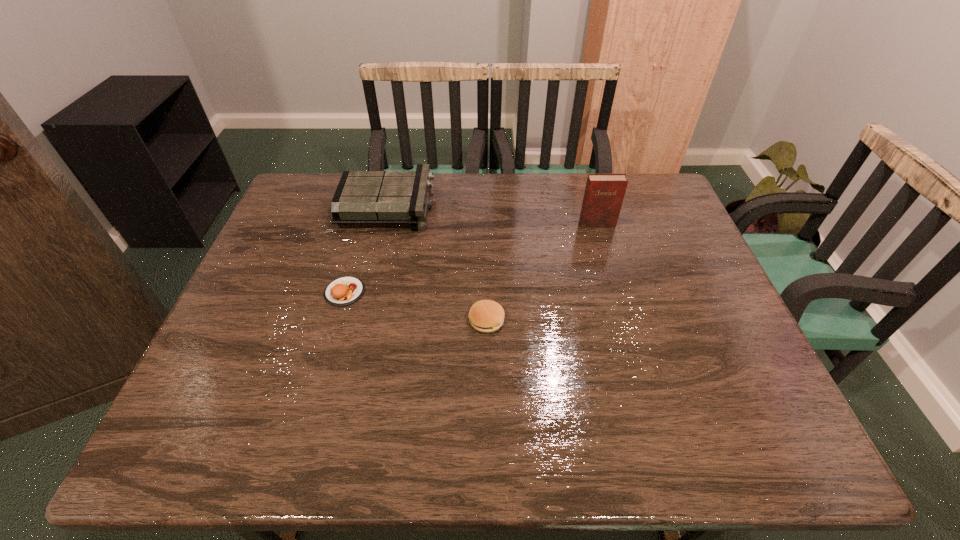
Choose which object is the nearest neighbor to the second object from right to left. Please provide its 2D coordinates. Your answer should be formatted as a tuple, i.e. [(x, y)], where the tuple contains the x and y coordinates of a point satisfying the conditions above.

[(343, 291)]

Locate an element on the screen. This screenshot has width=960, height=540. the third closest object relative to the second tallest object is located at coordinates (604, 193).

What are the coordinates of `vacant region that satisfies the following two spatial constraints: 1. on the front side of the right patty (food); 2. on the left side of the left patty (food)` in the screenshot? It's located at [336, 321].

I want to click on vacant space that satisfies the following two spatial constraints: 1. on the front panel of the third shortest object; 2. on the right side of the second object from right to left, so point(361,321).

Locate an element on the screen. free point that satisfies the following two spatial constraints: 1. on the front panel of the third shortest object; 2. on the back side of the third tallest object is located at coordinates (361, 321).